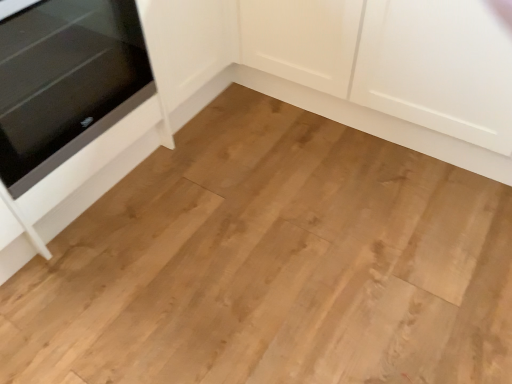
Measure the distance between point (423, 124) and camera.

The distance of point (423, 124) from camera is 1.66 meters.

This screenshot has width=512, height=384. Describe the element at coordinates (345, 80) in the screenshot. I see `white matte cabinet at center` at that location.

In order to face white matte cabinet at center, should I rotate leftwards or rightwards?

It's best to rotate right around 18.134 degrees.

What are the coordinates of `white matte cabinet at center` in the screenshot? It's located at (345, 80).

Where is `black glass oven at left`? The height and width of the screenshot is (384, 512). black glass oven at left is located at coordinates pos(66,82).

This screenshot has width=512, height=384. Describe the element at coordinates (66, 82) in the screenshot. I see `black glass oven at left` at that location.

The height and width of the screenshot is (384, 512). I want to click on white matte cabinet at center, so click(345, 80).

Considering the relative positions of white matte cabinet at center and black glass oven at left in the image provided, is white matte cabinet at center to the right of black glass oven at left from the viewer's perspective?

Indeed, white matte cabinet at center is positioned on the right side of black glass oven at left.

Which is in front, white matte cabinet at center or black glass oven at left?

black glass oven at left is more forward.

Is point (243, 34) positioned before point (34, 149)?

That is False.

From the image's perspective, relative to black glass oven at left, is white matte cabinet at center above or below?

white matte cabinet at center is above black glass oven at left.

From a real-world perspective, is white matte cabinet at center on top of black glass oven at left?

No.

Which of these two, white matte cabinet at center or black glass oven at left, is wider?

black glass oven at left is wider.

Is white matte cabinet at center taller or shorter than black glass oven at left?

white matte cabinet at center is taller than black glass oven at left.

Which of these two, white matte cabinet at center or black glass oven at left, is smaller?

black glass oven at left is smaller.

Is black glass oven at left completely or partially inside white matte cabinet at center?

Actually, black glass oven at left is outside white matte cabinet at center.

Based on the photo, is white matte cabinet at center positioned far away from black glass oven at left?

That's not correct — white matte cabinet at center is a little close to black glass oven at left.

In the scene shown: Is white matte cabinet at center positioned with its back to black glass oven at left?

No, white matte cabinet at center's orientation is not away from black glass oven at left.

How much distance is there between white matte cabinet at center and black glass oven at left?

white matte cabinet at center and black glass oven at left are 31.64 inches apart.

At what (x,y) coordinates should I click in order to perform the action: click on cabinetry lying behind the black glass oven at left. Please return your answer as a coordinate pair (x, y). Image resolution: width=512 pixels, height=384 pixels. Looking at the image, I should click on click(x=345, y=80).

Considering the positions of objects black glass oven at left and white matte cabinet at center in the image provided, who is more to the right, black glass oven at left or white matte cabinet at center?

white matte cabinet at center is more to the right.

Looking at this image, which is behind, black glass oven at left or white matte cabinet at center?

white matte cabinet at center is further from the camera.

Which point is more distant from viewer, (x=26, y=86) or (x=315, y=46)?

The point (x=315, y=46) is farther.

From the image's perspective, which one is positioned higher, black glass oven at left or white matte cabinet at center?

From the image's view, white matte cabinet at center is above.

From a real-world perspective, is black glass oven at left beneath white matte cabinet at center?

Incorrect, from a real-world perspective, black glass oven at left is higher than white matte cabinet at center.

Considering the sizes of black glass oven at left and white matte cabinet at center in the image, is black glass oven at left wider or thinner than white matte cabinet at center?

Clearly, black glass oven at left has more width compared to white matte cabinet at center.

From the picture: Can you confirm if black glass oven at left is shorter than white matte cabinet at center?

Yes.

Which of these two, black glass oven at left or white matte cabinet at center, is smaller?

Smaller between the two is black glass oven at left.

Is black glass oven at left outside of white matte cabinet at center?

black glass oven at left lies outside white matte cabinet at center's area.

Is black glass oven at left far from white matte cabinet at center?

No, black glass oven at left is in close proximity to white matte cabinet at center.

Could you tell me if black glass oven at left is turned towards white matte cabinet at center?

No, black glass oven at left is not facing towards white matte cabinet at center.

Locate an element on the screen. The width and height of the screenshot is (512, 384). oven in front of the white matte cabinet at center is located at coordinates (66, 82).

Identify the location of cabinetry located behind the black glass oven at left. The width and height of the screenshot is (512, 384). (345, 80).

The height and width of the screenshot is (384, 512). Find the location of `cabinetry located above the black glass oven at left (from the image's perspective)`. cabinetry located above the black glass oven at left (from the image's perspective) is located at coordinates (345, 80).